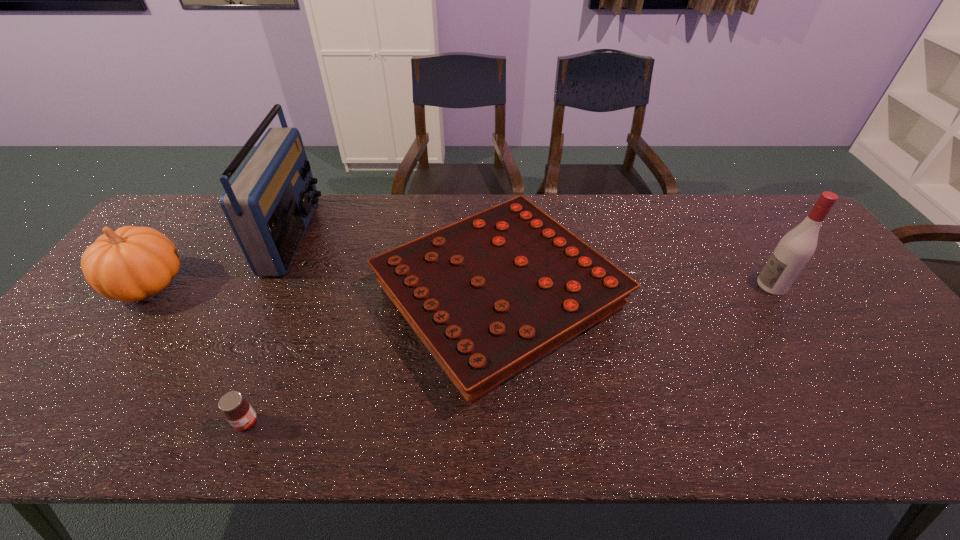
This screenshot has width=960, height=540. I want to click on radio receiver, so click(x=269, y=203).

This screenshot has width=960, height=540. Find the location of `alcohol`. alcohol is located at coordinates (794, 250).

At what (x,y) coordinates should I click in order to perform the action: click on the third tallest object. Please return your answer as a coordinate pair (x, y). The width and height of the screenshot is (960, 540). Looking at the image, I should click on (132, 263).

Find the location of a particular element. the leftmost object is located at coordinates (132, 263).

Locate an element on the screen. gameboard is located at coordinates (489, 295).

What are the coordinates of `the third object from right to left` in the screenshot? It's located at (238, 412).

At what (x,y) coordinates should I click in order to perform the action: click on free space located 0.280m on the front panel of the second object from left to right. Please return your answer as a coordinate pair (x, y). The width and height of the screenshot is (960, 540). Looking at the image, I should click on (400, 235).

Image resolution: width=960 pixels, height=540 pixels. Find the location of `free space located on the label of the alcohol`. free space located on the label of the alcohol is located at coordinates (617, 285).

Locate an element on the screen. vacant region located 0.230m on the label of the alcohol is located at coordinates (675, 285).

Find the location of a particular element. The height and width of the screenshot is (540, 960). vacant area located on the label of the alcohol is located at coordinates (671, 285).